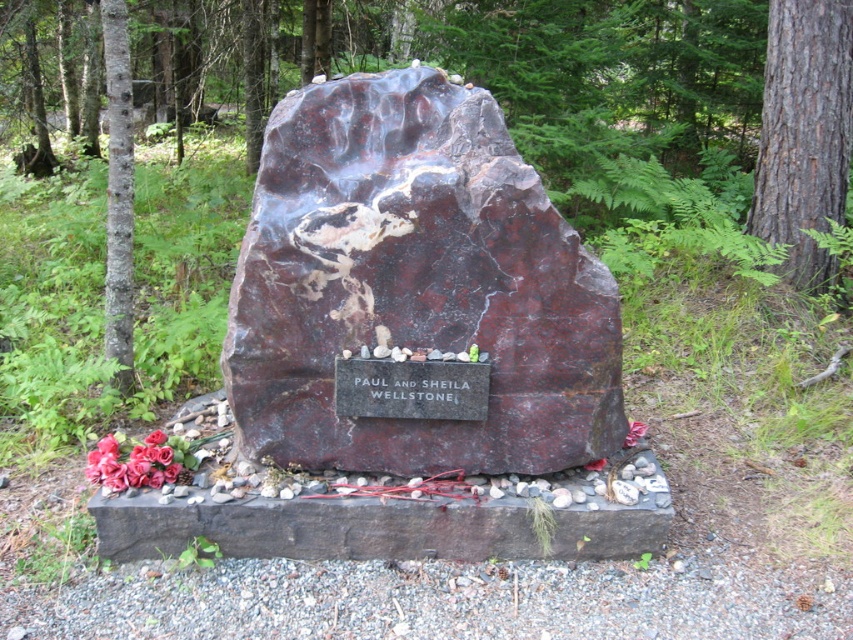
Question: Considering the relative positions of brown rough bark tree at right and brown rough bark tree at left in the image provided, where is brown rough bark tree at right located with respect to brown rough bark tree at left?

Choices:
 (A) above
 (B) below

Answer: (A)

Question: Is brown rough bark tree at left positioned before marble plaque at center?

Choices:
 (A) yes
 (B) no

Answer: (B)

Question: Which object appears closest to the camera in this image?

Choices:
 (A) brown rough bark tree at left
 (B) brown rough bark tree at right
 (C) marble plaque at center

Answer: (C)

Question: Which point appears farthest from the camera in this image?

Choices:
 (A) (149, 433)
 (B) (129, 385)

Answer: (B)

Question: Can you confirm if brown rough bark tree at left is positioned to the left of matte pink petals at lower left?

Choices:
 (A) no
 (B) yes

Answer: (B)

Question: Which of the following is the closest to the observer?

Choices:
 (A) brown rough bark tree at left
 (B) marble plaque at center
 (C) brown rough bark tree at right
 (D) matte pink petals at lower left

Answer: (B)